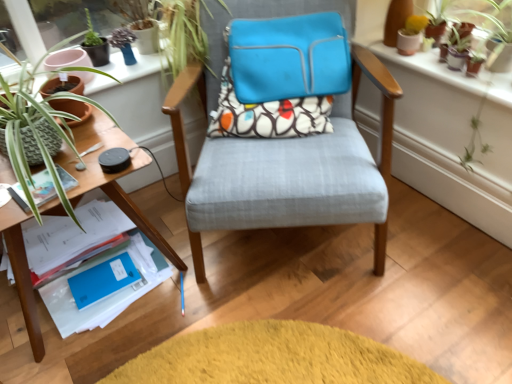
This screenshot has height=384, width=512. What are the coordinates of `vacant space in front of matte paper at left, placed as the second paperback book when sorted from bottom to top` in the screenshot? It's located at (23, 203).